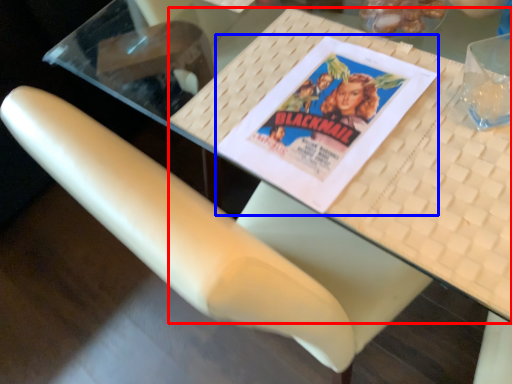
Question: Which object appears farthest to the camera in this image, table (highlighted by a red box) or paperback book (highlighted by a blue box)?

Choices:
 (A) table
 (B) paperback book

Answer: (B)